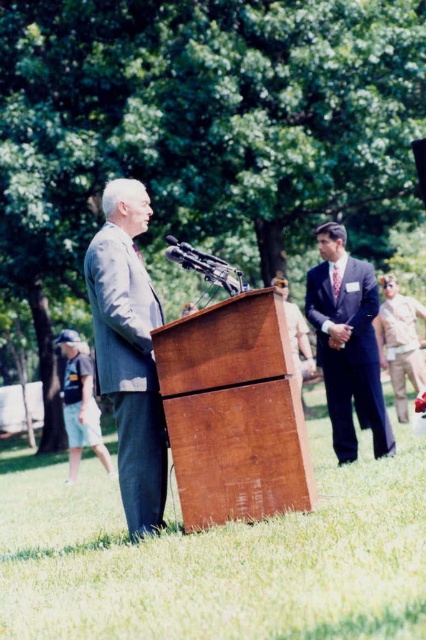
You are attending an outdoor event and see two people wearing suits. One is wearing a gray suit at center and the other a dark gray suit at right. Which person is standing more to the left?

The gray suit at center is more to the left than the dark gray suit at right.